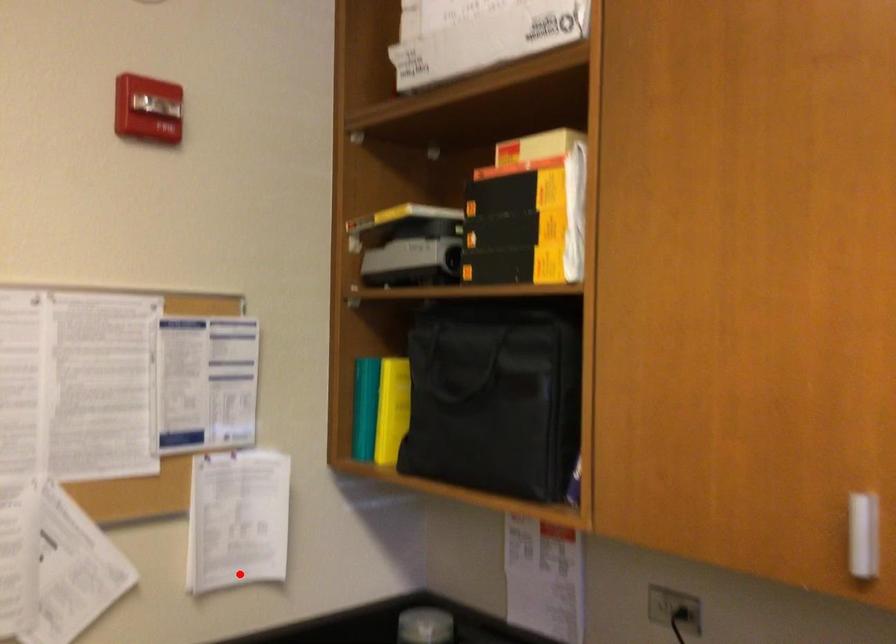
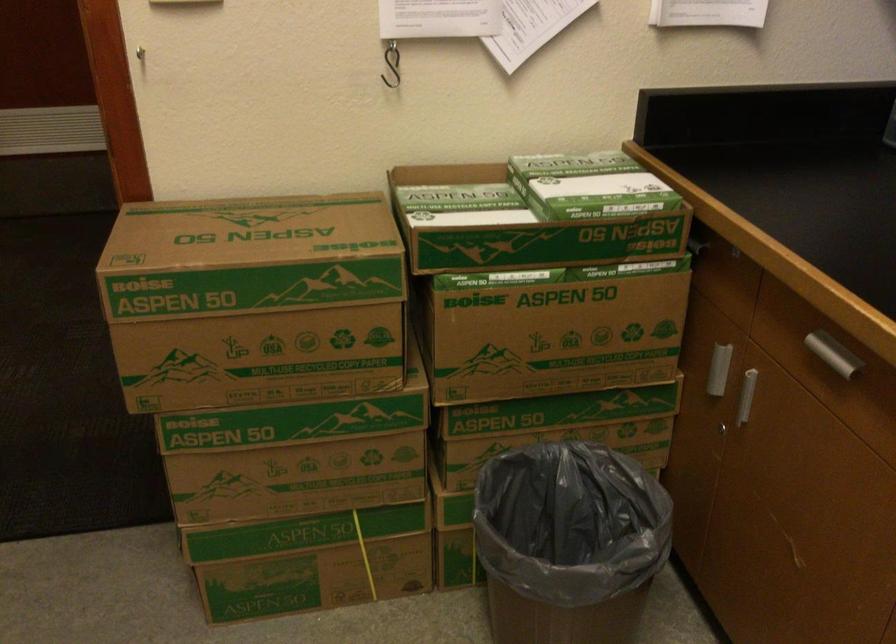
Question: A red point is marked in image1. In image2, is the corresponding 3D point closer to the camera or farther? Reply with the corresponding letter.

Choices:
 (A) The corresponding 3D point is closer.
 (B) The corresponding 3D point is farther.

Answer: (A)